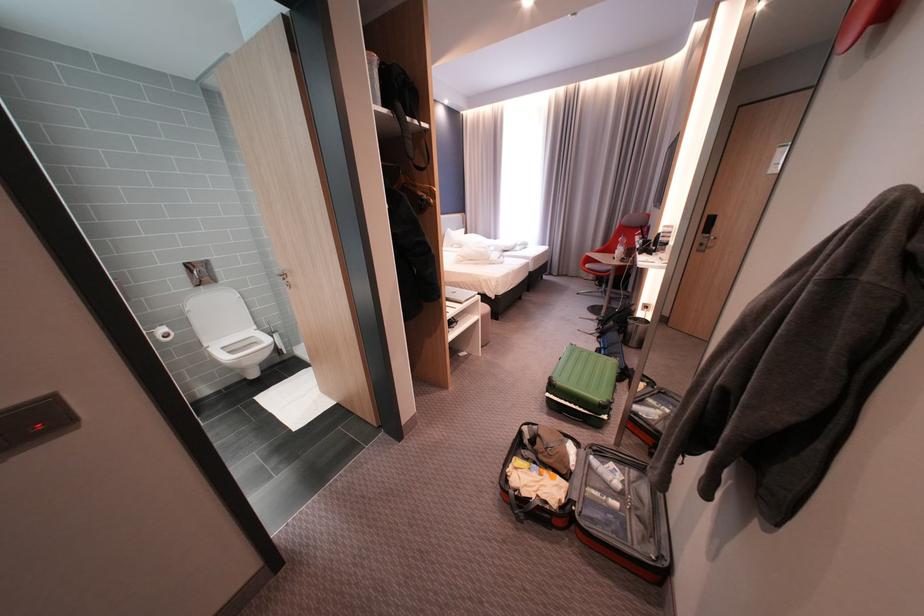
Describe the element at coordinates (284, 277) in the screenshot. The image size is (924, 616). I see `a metal door handle` at that location.